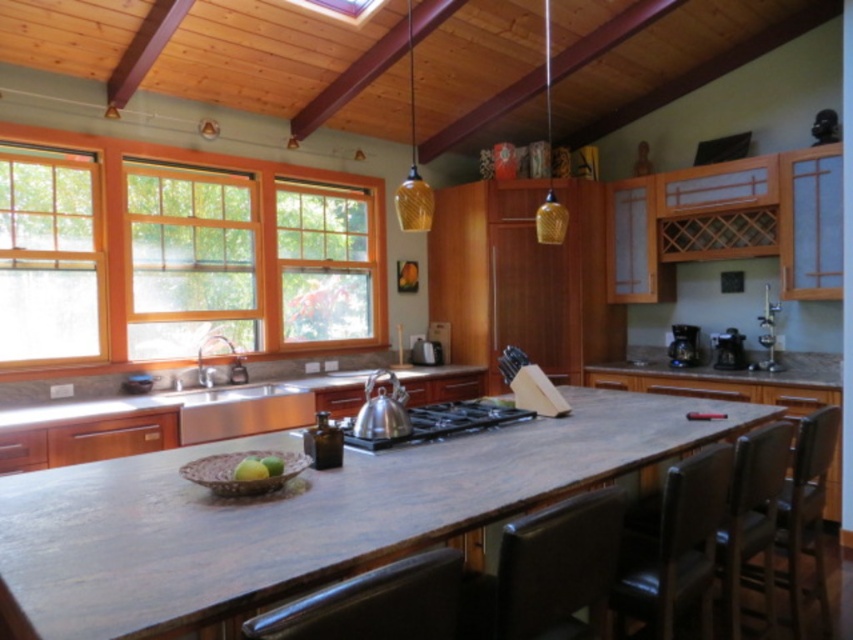
You are a chef preparing a meal and need to place a heavy pot on a stable surface. The rustic wood counter top at center and the brown polished wood at right are both available. Based on their positions, which surface is more likely to be sturdy enough to support the pot?

The rustic wood counter top at center is below the brown polished wood at right. Since it is positioned lower, it is more likely to be the main counter surface designed for heavy use, making it sturdier for placing the pot.

You are standing in the kitchen and want to reach the satin nickel toaster at center. There is a leather at right in your way. Can you move around it to access the toaster?

The leather at right is in front of the satin nickel toaster at center, so you can move around it to access the toaster since it is not blocking the entire path.

You are preparing breakfast and want to place a green matte apple at center on the counter near the black matte coffee maker at right. Is the coffee maker positioned in a way that allows you to easily access the apple?

The black matte coffee maker at right is above the green matte apple at center, so it is placed higher up, which might block direct access to the apple unless you move the coffee maker.